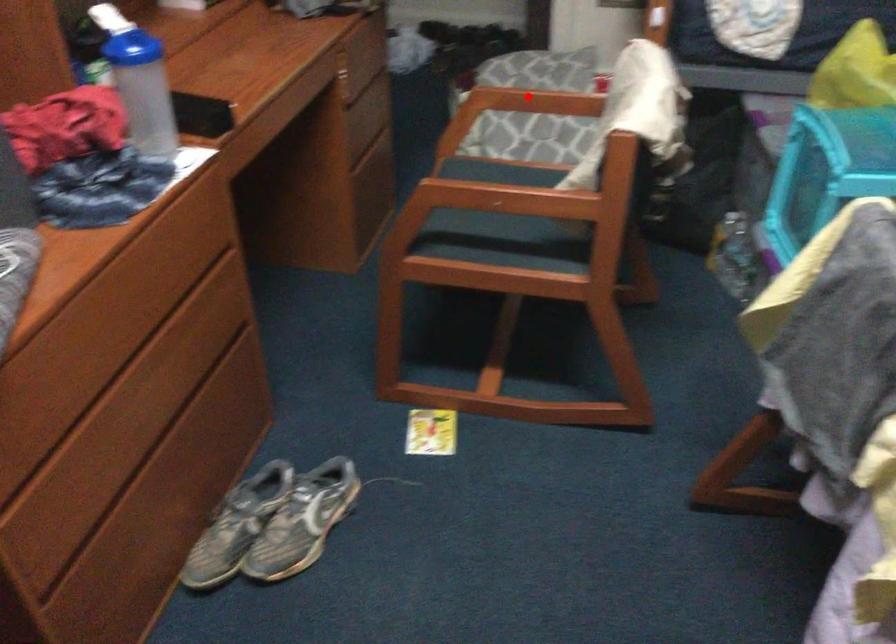
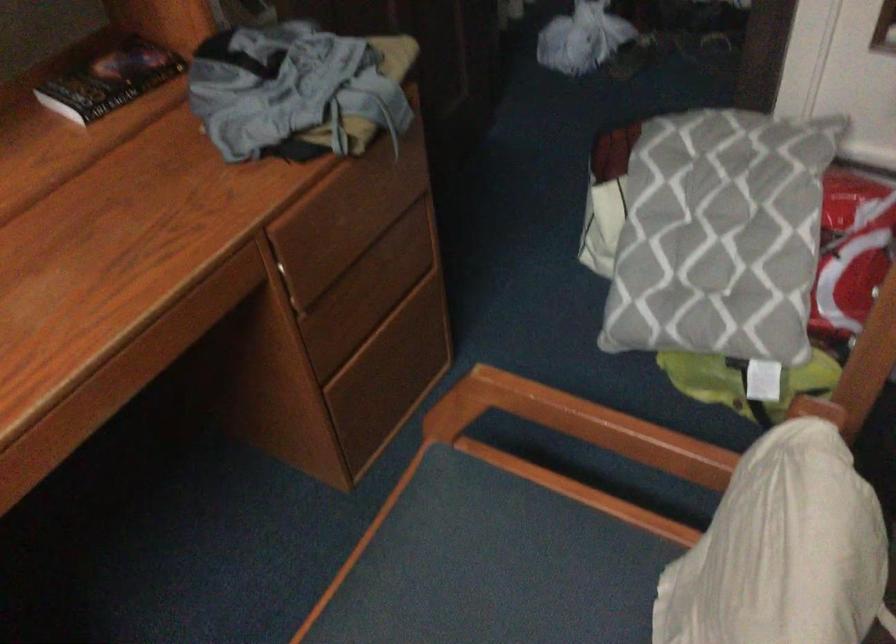
Question: I am providing you with two images of the same scene from different viewpoints. Given a red point in image1, look at the same physical point in image2. Is it:

Choices:
 (A) Closer to the viewpoint
 (B) Farther from the viewpoint

Answer: (A)